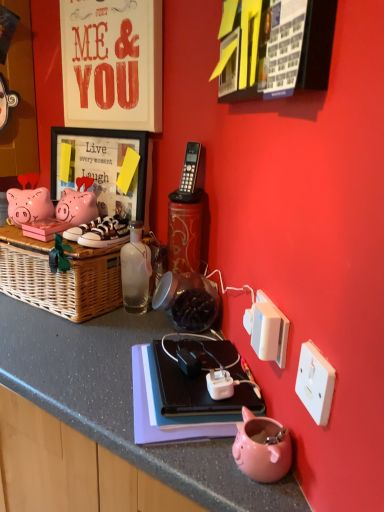
Question: Considering the positions of matte black picture frame at upper left and white plastic power outlet at lower right, arranged as the 1th power outlet when viewed from the front, in the image, is matte black picture frame at upper left taller or shorter than white plastic power outlet at lower right, arranged as the 1th power outlet when viewed from the front,?

Choices:
 (A) short
 (B) tall

Answer: (B)

Question: Looking at the image, does matte black picture frame at upper left seem bigger or smaller compared to white plastic power outlet at lower right, which is counted as the 2th power outlet, starting from the left?

Choices:
 (A) big
 (B) small

Answer: (A)

Question: Estimate the real-world distances between objects in this image. Which object is closer to the white leather sneakers at left, positioned as the first footwear in left-to-right order?

Choices:
 (A) white plastic power outlet at lower right, marked as the second power outlet in a back-to-front arrangement
 (B) white plastic power outlet at lower right, which appears as the 2th power outlet when viewed from the right
 (C) pink glossy piggy bank at lower center
 (D) white canvas sneakers at center, which ranks as the 2th footwear in left-to-right order
 (E) matte black picture frame at upper left

Answer: (D)

Question: Which of these objects is positioned closest to the matte black picture frame at upper left?

Choices:
 (A) white plastic power outlet at lower right, which appears as the 2th power outlet when viewed from the right
 (B) transparent glass bottle at center
 (C) white plastic light switch at upper right
 (D) white plastic power outlet at lower right, the first power outlet when ordered from right to left
 (E) pink glossy piggy bank at lower center

Answer: (B)